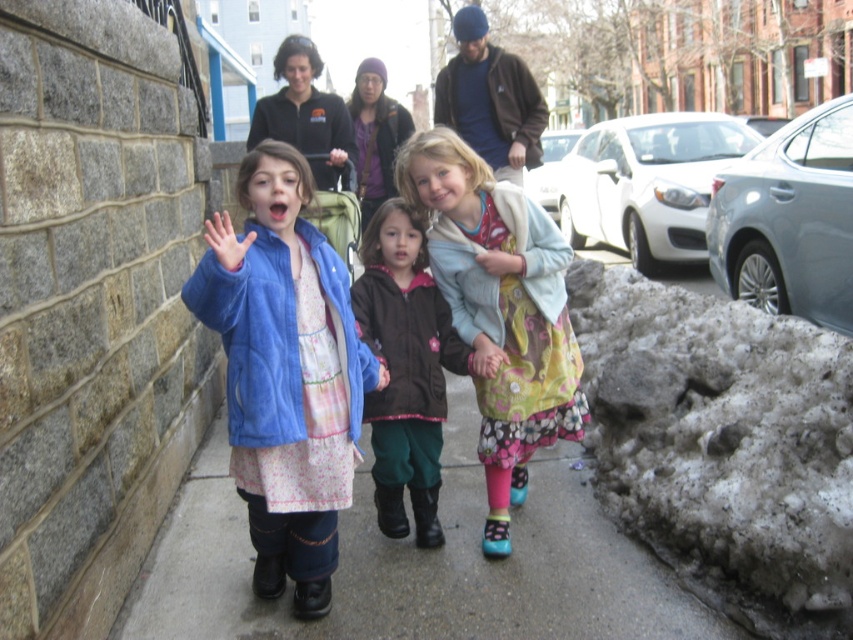
Question: Which point is farther to the camera?

Choices:
 (A) floral dress at center
 (B) smooth concrete sidewalk at center
 (C) floral fabric dress at center

Answer: (C)

Question: Which object appears farthest from the camera in this image?

Choices:
 (A) floral fabric dress at center
 (B) floral dress at center
 (C) matte blue jacket at center

Answer: (A)

Question: Which of the following is the farthest from the observer?

Choices:
 (A) matte blue jacket at center
 (B) smooth concrete sidewalk at center
 (C) floral dress at center
 (D) floral fabric dress at center

Answer: (D)

Question: Can you confirm if smooth concrete sidewalk at center is smaller than floral dress at center?

Choices:
 (A) no
 (B) yes

Answer: (A)

Question: Observing the image, what is the correct spatial positioning of smooth concrete sidewalk at center in reference to floral dress at center?

Choices:
 (A) right
 (B) left

Answer: (B)

Question: Does smooth concrete sidewalk at center appear over floral dress at center?

Choices:
 (A) no
 (B) yes

Answer: (A)